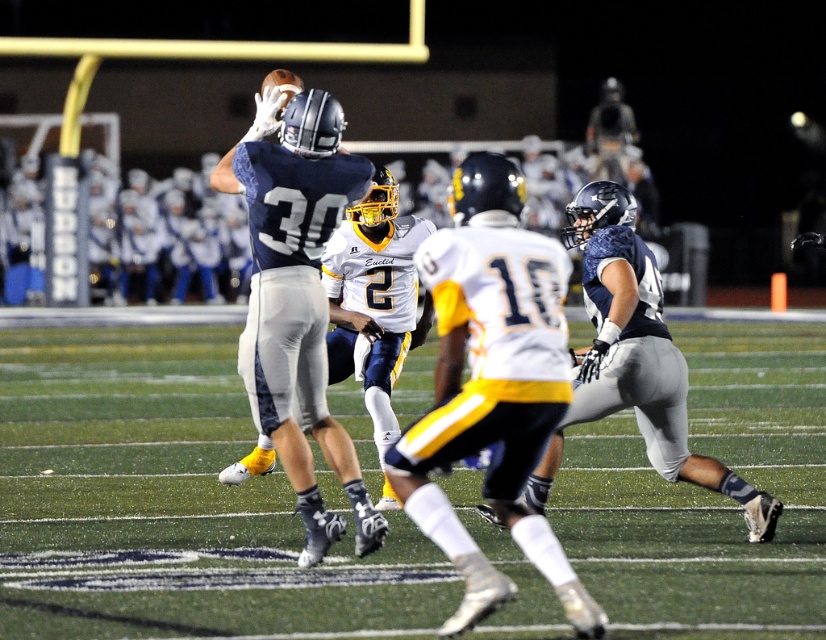
You are a sports analyst watching the game. You notice two players on the field. The first is a player wearing a navy blue jersey with the number 30 in midair, and the second is the white jersey at center. Based on their positions, which player is closer to the center of the field?

The white jersey at center is located at point [492,385], which is closer to the center of the field compared to the player in the navy blue jersey with the number 30 who is in midair.

You are a football coach analyzing the game from the sidelines. You notice the green turf at center and the matte blue jersey at center. How far apart are these two objects in meters?

The green turf at center and the matte blue jersey at center are 3.26 meters apart.